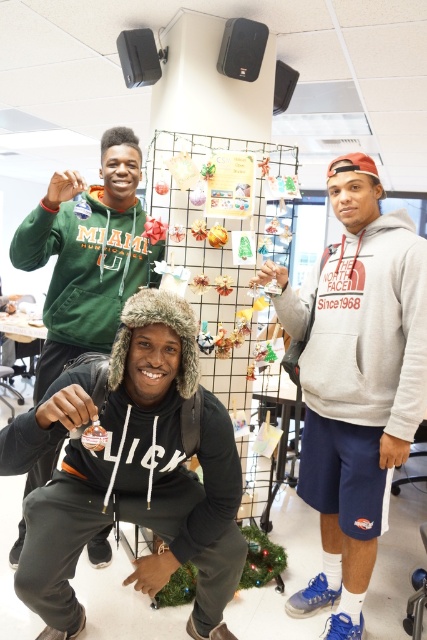
Can you confirm if gray fleece hoodie at center is taller than matte black hoodie at center?

Yes, gray fleece hoodie at center is taller than matte black hoodie at center.

Is gray fleece hoodie at center positioned before matte black hoodie at center?

Yes, gray fleece hoodie at center is in front of matte black hoodie at center.

The image size is (427, 640). In order to click on gray fleece hoodie at center in this screenshot , I will do 356,381.

At what (x,y) coordinates should I click in order to perform the action: click on gray fleece hoodie at center. Please return your answer as a coordinate pair (x, y). The image size is (427, 640). Looking at the image, I should click on (356, 381).

Is gray fleece hoodie at center closer to the viewer compared to metallic wire mesh at center?

Yes, it is.

Is gray fleece hoodie at center taller than metallic wire mesh at center?

In fact, gray fleece hoodie at center may be shorter than metallic wire mesh at center.

Where is `gray fleece hoodie at center`? Image resolution: width=427 pixels, height=640 pixels. gray fleece hoodie at center is located at coordinates (356, 381).

Is black fuzzy hat at lower left shorter than gray fleece hoodie at center?

Yes.

This screenshot has width=427, height=640. What do you see at coordinates (131, 472) in the screenshot? I see `black fuzzy hat at lower left` at bounding box center [131, 472].

I want to click on black fuzzy hat at lower left, so click(131, 472).